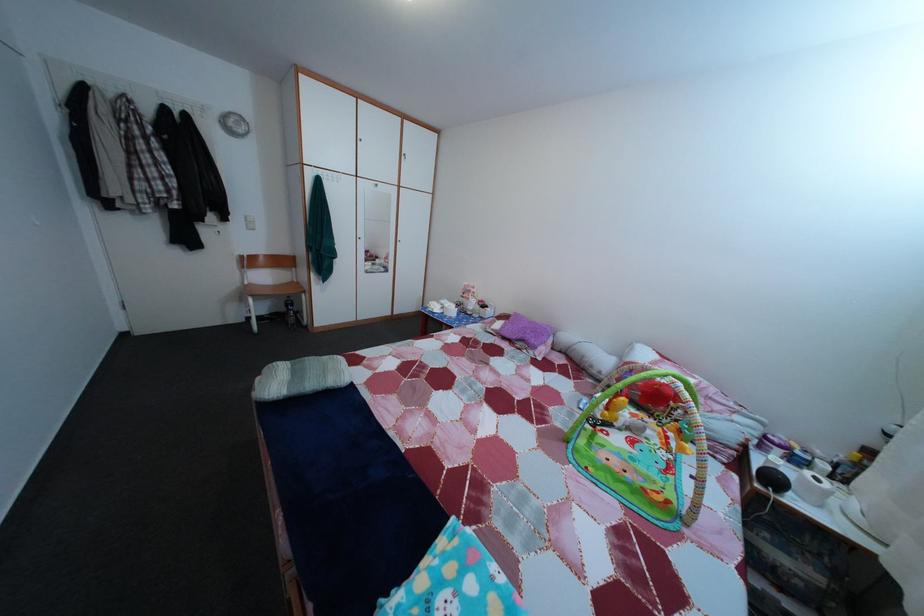
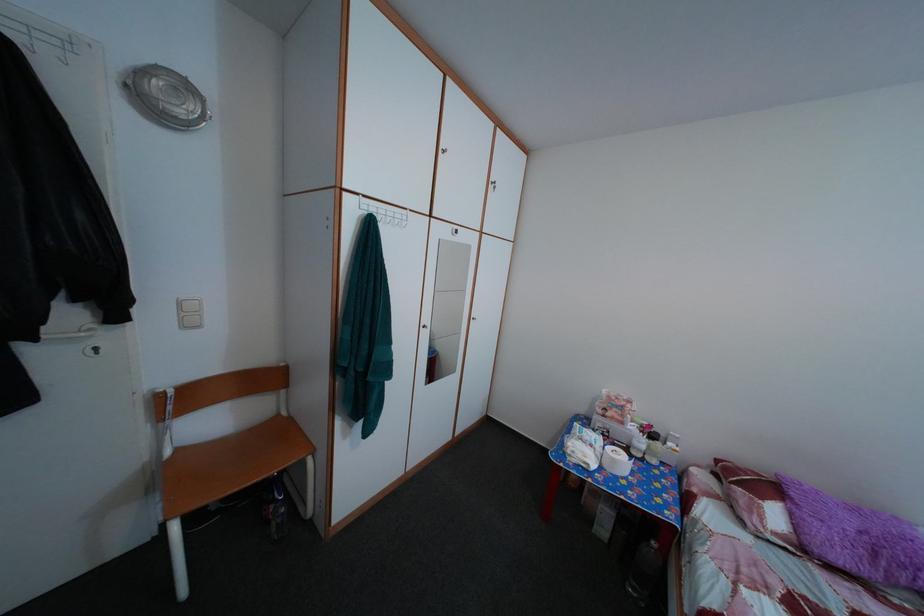
In a continuous first-person perspective shot, in which direction is the camera moving?

The movement direction of the cameraman is left, forward.